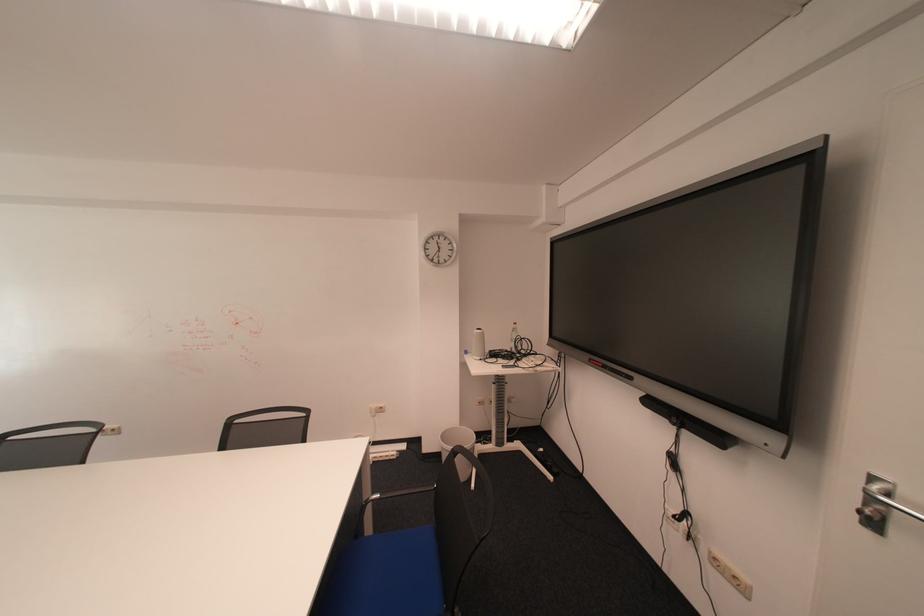
The width and height of the screenshot is (924, 616). I want to click on silver door handle, so click(893, 504).